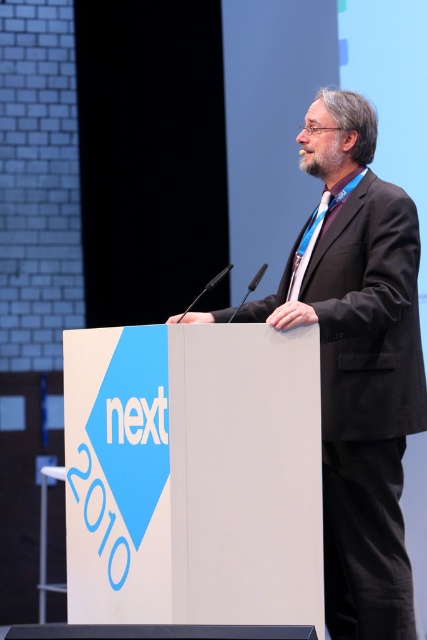
Looking at this image, you are a photographer adjusting the camera focus. The camera can only focus on one object at a time. You need to capture both the black suit at center and the blue silk tie at center in sharp detail. Can you do this with a single shot?

The black suit at center and blue silk tie at center are 10.35 inches apart from each other. Since they are close enough within the same focal plane, the photographer can adjust the camera to focus on both objects simultaneously in a single shot.

You are an event organizer and need to place a small microphone stand exactly at the point marked by the coordinates point (359, 365). According to the image, where will the microphone stand be placed?

The microphone stand will be placed on the black suit at center, as the point (359, 365) is located there.